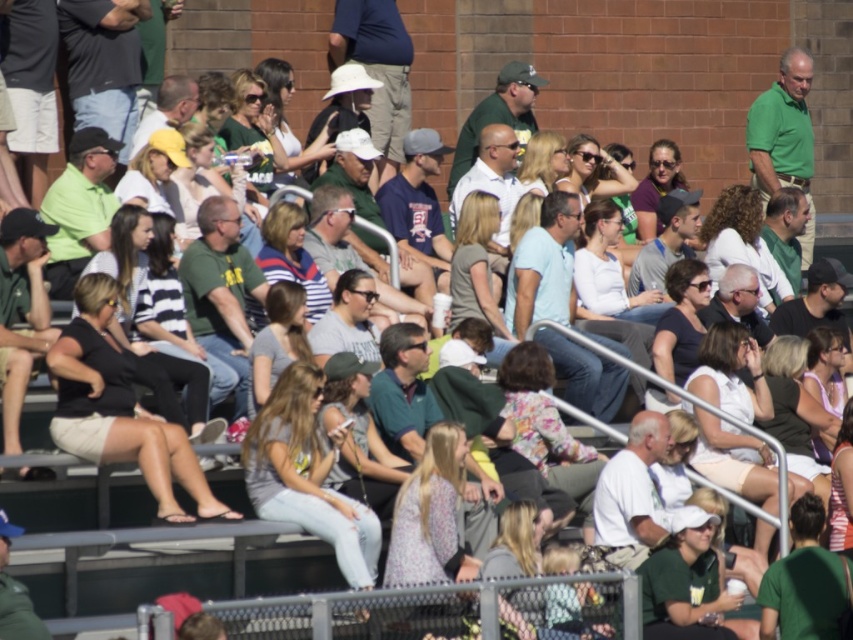
Question: Which of the following is the farthest from the observer?

Choices:
 (A) gray cotton shirt at center
 (B) matte green shirt at left

Answer: (B)

Question: Can you confirm if light blue cotton shirt at center is wider than white fabric shirt at center?

Choices:
 (A) no
 (B) yes

Answer: (B)

Question: Does gray cotton shirt at center have a larger size compared to gray fabric shirt at center?

Choices:
 (A) no
 (B) yes

Answer: (B)

Question: Estimate the real-world distances between objects in this image. Which object is closer to the black fabric skirt at lower left?

Choices:
 (A) light brown hair at center
 (B) gray cotton shirt at center
 (C) striped cotton shirt at center
 (D) green jersey at center

Answer: (B)

Question: Which object is farther from the camera taking this photo?

Choices:
 (A) light brown hair at center
 (B) black fabric skirt at lower left
 (C) striped cotton shirt at center

Answer: (A)

Question: Is matte green shirt at left to the left of light brown hair at center from the viewer's perspective?

Choices:
 (A) yes
 (B) no

Answer: (A)